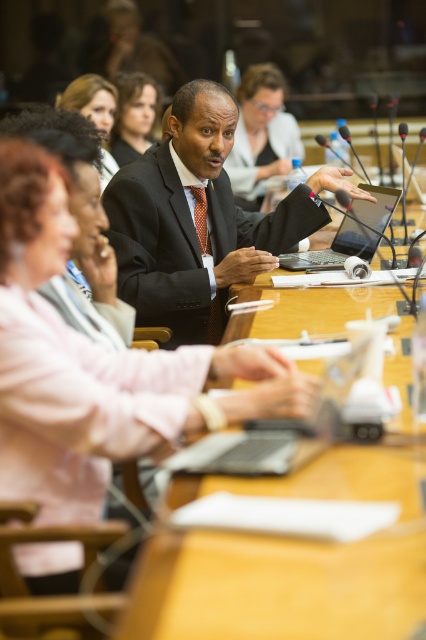
You are attending a meeting and need to locate two key figures based on their attire and physical features. The first is someone wearing a dark gray suit at center, and the second has matte black hair at upper center. Which of these two figures occupies a larger portion of the frame?

The dark gray suit at center is bigger than matte black hair at upper center, so the figure wearing the dark gray suit at center occupies a larger portion of the frame.

You are attending a meeting and need to present a document. You see the silver metallic laptop at center and the red silk tie at center. Which object is more suitable for displaying the document during your presentation?

The silver metallic laptop at center is more suitable for displaying the document during your presentation because it has a larger size compared to the red silk tie at center.

You are a participant in the meeting and need to pass a document from the silver metallic laptop at center to the person wearing the red silk tie at center. Which direction should you move the document to ensure it reaches them?

The silver metallic laptop at center is to the right of the red silk tie at center, so you should move the document to the left to reach the person wearing the red silk tie at center.